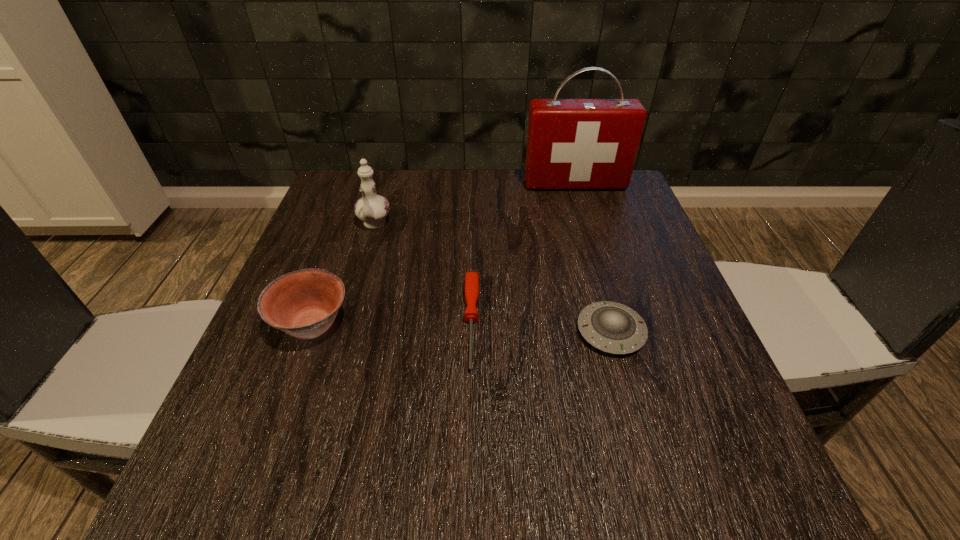
Where is `object that is at the far right corner`? object that is at the far right corner is located at coordinates click(x=572, y=144).

The image size is (960, 540). What are the coordinates of `vacant space at the far edge` in the screenshot? It's located at (404, 174).

Find the location of a particular element. The height and width of the screenshot is (540, 960). free space at the near edge is located at coordinates (396, 451).

In the image, there is a desktop. Where is `vacant space at the left edge`? vacant space at the left edge is located at coordinates (325, 415).

You are a GUI agent. You are given a task and a screenshot of the screen. Output one action in this format:
    pyautogui.click(x=<x>, y=<y>)
    Task: Click on the vacant space at the right edge of the desktop
    
    Given the screenshot: What is the action you would take?
    pyautogui.click(x=617, y=234)

This screenshot has width=960, height=540. I want to click on blank space at the far left corner, so click(341, 184).

Identify the location of free space at the far right corner of the desktop. This screenshot has height=540, width=960. (618, 215).

I want to click on free space at the near right corner, so click(x=650, y=469).

Locate an element on the screen. The image size is (960, 540). vacant area that lies between the third shortest object and the saucer is located at coordinates (462, 328).

Where is `free space between the first-aid kit and the third shortest object`? Image resolution: width=960 pixels, height=540 pixels. free space between the first-aid kit and the third shortest object is located at coordinates (444, 254).